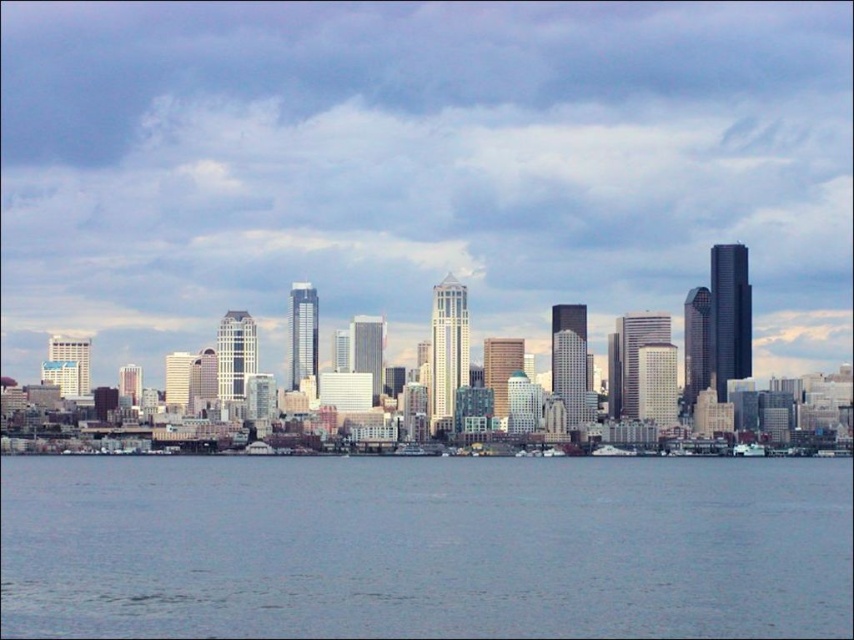
From the picture: What can be found at the coordinates point [425,547] in the image?

At point [425,547] lies gray water at lower center.

You are a tour guide explaining the city skyline to visitors. You point out the gray water at lower center and the white glossy boat at center. How far apart are these two landmarks?

The gray water at lower center is 54.78 meters from the white glossy boat at center.

You are standing at the camera position and want to take a photo of the matte glass skyscrapers at center. If your camera has a maximum focus range of 2000 feet, will it be able to capture the skyscrapers clearly?

The matte glass skyscrapers at center and camera are 2109.75 feet apart from each other. Since the distance exceeds the camera maximum focus range of 2000 feet, the camera will not be able to capture the skyscrapers clearly.